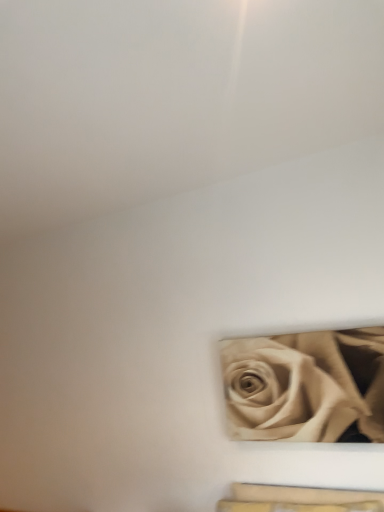
The height and width of the screenshot is (512, 384). I want to click on beige textured rose at lower right, so click(x=306, y=386).

The height and width of the screenshot is (512, 384). Describe the element at coordinates (306, 386) in the screenshot. I see `beige textured rose at lower right` at that location.

Where is `beige textured rose at lower right`? Image resolution: width=384 pixels, height=512 pixels. beige textured rose at lower right is located at coordinates (306, 386).